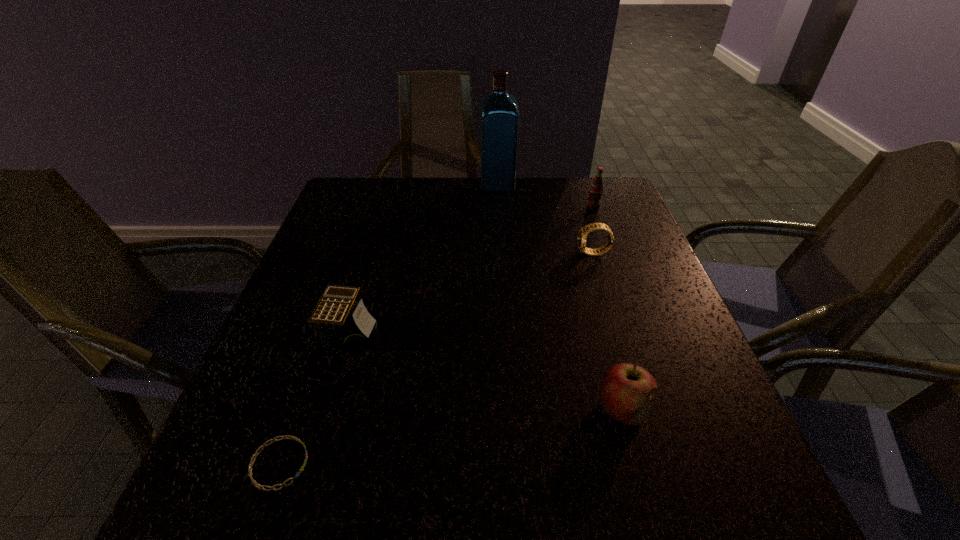
Locate an element on the screen. free space between the third object from left to right and the calculator is located at coordinates (424, 260).

Identify the location of vacant region between the third nearest object and the liquor. This screenshot has width=960, height=540. (424, 260).

Locate an element on the screen. blank region between the liquor and the nearest object is located at coordinates [389, 325].

I want to click on unoccupied position between the calculator and the soda, so click(x=472, y=271).

Choose which object is the second nearest neighbor to the shortest object. Please provide its 2D coordinates. Your answer should be formatted as a tuple, i.e. [(x, y)], where the tuple contains the x and y coordinates of a point satisfying the conditions above.

[(626, 390)]

Identify the location of the fifth closest object to the calculator. (596, 188).

I want to click on vacant position in the image that satisfies the following two spatial constraints: 1. on the flat label side of the fourth object from right to left; 2. on the back side of the fifth farthest object, so click(511, 409).

Identify the location of free location that satisfies the following two spatial constraints: 1. on the flat label side of the third object from left to right; 2. on the back side of the soda. The height and width of the screenshot is (540, 960). (498, 207).

Where is `free point that satisfies the following two spatial constraints: 1. on the front side of the second farthest object; 2. on the surface of the nearest object showing star-shaped elements`? This screenshot has width=960, height=540. free point that satisfies the following two spatial constraints: 1. on the front side of the second farthest object; 2. on the surface of the nearest object showing star-shaped elements is located at coordinates (685, 464).

Find the location of a particular element. This screenshot has height=540, width=960. free space that satisfies the following two spatial constraints: 1. on the flat label side of the liquor; 2. on the right side of the fifth farthest object is located at coordinates (511, 409).